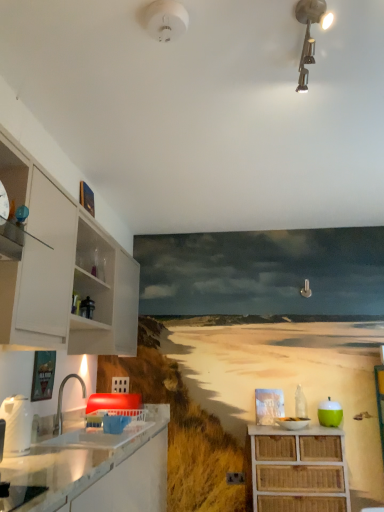
Question: Is white glossy cabinet at left, the 2th cabinetry when ordered from bottom to top, not near metallic track lighting at upper center, which appears as the 1th light fixture when viewed from the right?

Choices:
 (A) no
 (B) yes

Answer: (B)

Question: Can you confirm if white glossy cabinet at left, the first cabinetry positioned from the left, is shorter than metallic track lighting at upper center, which appears as the 1th light fixture when viewed from the right?

Choices:
 (A) no
 (B) yes

Answer: (A)

Question: Is white glossy cabinet at left, which is the first cabinetry in top-to-bottom order, behind metallic track lighting at upper center, which is the second light fixture from left to right?

Choices:
 (A) yes
 (B) no

Answer: (A)

Question: Is white glossy cabinet at left, the 2th cabinetry when ordered from bottom to top, oriented towards metallic track lighting at upper center, which is the second light fixture from left to right?

Choices:
 (A) yes
 (B) no

Answer: (A)

Question: Can you confirm if white glossy cabinet at left, which is the first cabinetry in top-to-bottom order, is wider than metallic track lighting at upper center, which is the second light fixture from left to right?

Choices:
 (A) no
 (B) yes

Answer: (A)

Question: Considering the relative positions of white glossy kettle at left, the second appliance from the bottom, and white glossy sink at lower left in the image provided, is white glossy kettle at left, the second appliance from the bottom, to the left or to the right of white glossy sink at lower left?

Choices:
 (A) right
 (B) left

Answer: (B)

Question: From a real-world perspective, relative to white glossy sink at lower left, is white glossy kettle at left, placed as the 2th appliance when sorted from back to front, vertically above or below?

Choices:
 (A) below
 (B) above

Answer: (A)

Question: Is white glossy kettle at left, the second appliance from the bottom, inside the boundaries of white glossy sink at lower left, or outside?

Choices:
 (A) outside
 (B) inside

Answer: (A)

Question: Is white glossy kettle at left, marked as the 1th appliance in a top-to-bottom arrangement, wider or thinner than white glossy sink at lower left?

Choices:
 (A) wide
 (B) thin

Answer: (B)

Question: From the image's perspective, is green matte apple at right, the second appliance in the top-to-bottom sequence, located above or below white glossy sink at lower left?

Choices:
 (A) above
 (B) below

Answer: (B)

Question: Considering the positions of green matte apple at right, which is the first appliance from bottom to top, and white glossy sink at lower left in the image, is green matte apple at right, which is the first appliance from bottom to top, taller or shorter than white glossy sink at lower left?

Choices:
 (A) tall
 (B) short

Answer: (B)

Question: Is green matte apple at right, the first appliance from the back, in front of or behind white glossy sink at lower left in the image?

Choices:
 (A) behind
 (B) front

Answer: (A)

Question: In terms of width, does green matte apple at right, the second appliance viewed from the left, look wider or thinner when compared to white glossy sink at lower left?

Choices:
 (A) thin
 (B) wide

Answer: (A)

Question: From the image's perspective, is metallic track lighting at upper center, which appears as the 1th light fixture when viewed from the right, located above or below white glossy sink at lower left?

Choices:
 (A) above
 (B) below

Answer: (A)

Question: Visually, is metallic track lighting at upper center, which is the second light fixture from left to right, positioned to the left or to the right of white glossy sink at lower left?

Choices:
 (A) left
 (B) right

Answer: (B)